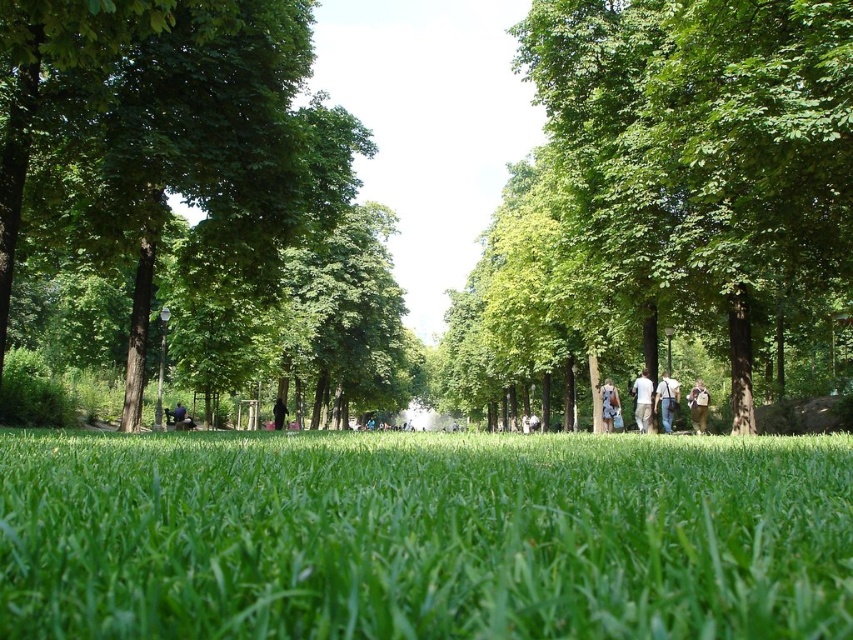
Can you confirm if green grass at center is shorter than green leafy tree at center?

Yes.

Is green grass at center positioned before green leafy tree at center?

That is True.

Is point (717, 436) farther from camera compared to point (546, 304)?

No, (717, 436) is closer to viewer.

Where is `green grass at center`? The height and width of the screenshot is (640, 853). green grass at center is located at coordinates (424, 536).

Does green leafy tree at left appear over dark blue fabric at center?

Yes.

How distant is green leafy tree at left from dark blue fabric at center?

A distance of 19.50 meters exists between green leafy tree at left and dark blue fabric at center.

Is point (114, 240) more distant than point (177, 422)?

No, it is in front of (177, 422).

Where is `green leafy tree at left`? green leafy tree at left is located at coordinates (166, 138).

Is white cotton shirt at center taller than camouflage fabric jacket at center?

Incorrect, white cotton shirt at center's height is not larger of camouflage fabric jacket at center's.

Is white cotton shirt at center smaller than camouflage fabric jacket at center?

Yes.

Measure the distance between point (643,369) and camera.

Point (643,369) and camera are 29.66 meters apart from each other.

Locate an element on the screen. Image resolution: width=853 pixels, height=640 pixels. white cotton shirt at center is located at coordinates (642, 401).